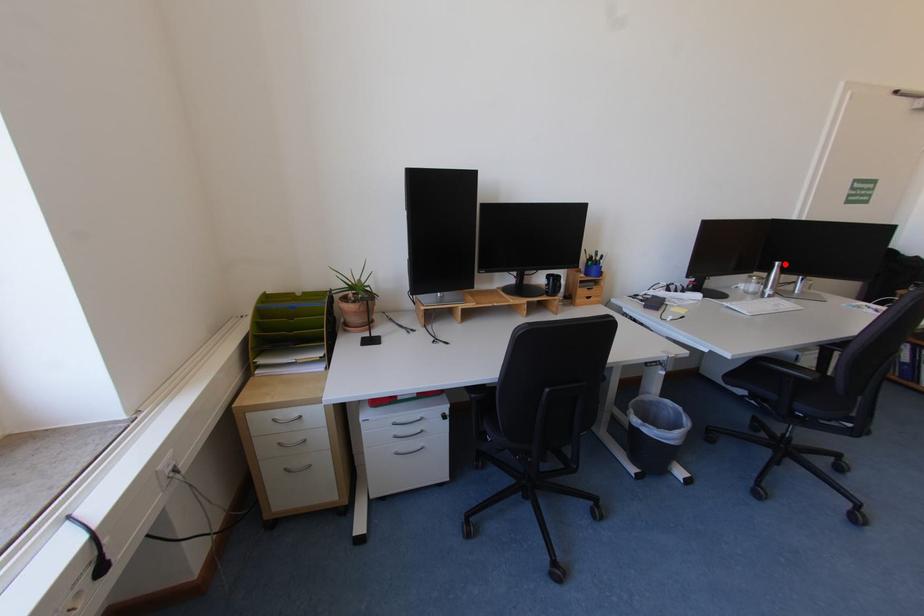
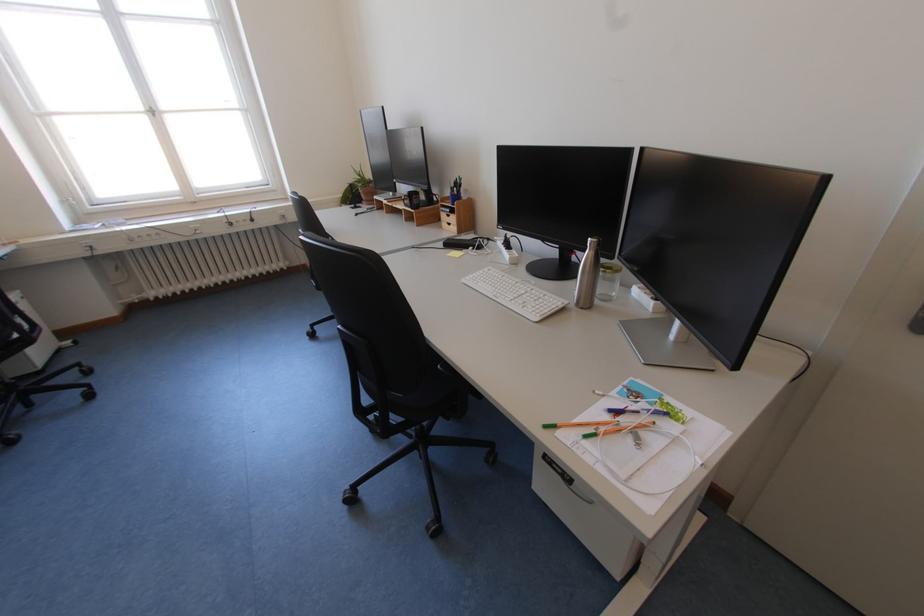
Locate, in the second image, the point that corresponds to the highlighted location in the first image.

(599, 240)